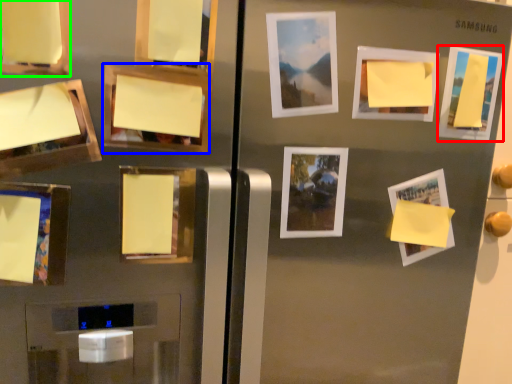
Question: Which object is the closest to the picture frame (highlighted by a red box)? Choose among these: picture frame (highlighted by a blue box) or picture frame (highlighted by a green box).

Choices:
 (A) picture frame
 (B) picture frame

Answer: (A)